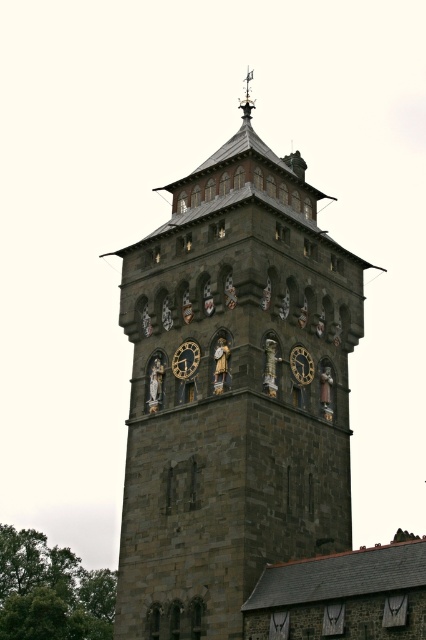
Between dark brown stone clock at center and gold/brass weather vane at top, which one is positioned higher?

gold/brass weather vane at top

Does dark brown stone clock at center have a lesser height compared to gold/brass weather vane at top?

Yes, dark brown stone clock at center is shorter than gold/brass weather vane at top.

Does point (195, 364) come closer to viewer compared to point (250, 100)?

Yes, it is.

You are a GUI agent. You are given a task and a screenshot of the screen. Output one action in this format:
    pyautogui.click(x=<x>, y=<y>)
    Task: Click on the dark brown stone clock at center
    The image size is (426, 640).
    Given the screenshot: What is the action you would take?
    pyautogui.click(x=186, y=358)

Can you confirm if dark brown stone clock at center is positioned above gold metallic clock at center?

Indeed, dark brown stone clock at center is positioned over gold metallic clock at center.

Which is above, dark brown stone clock at center or gold metallic clock at center?

dark brown stone clock at center is above.

This screenshot has width=426, height=640. Identify the location of dark brown stone clock at center. 186,358.

Is point (199, 636) farther from viewer compared to point (308, 365)?

No, it is in front of (308, 365).

Does dark stone clock tower at center have a greater width compared to gold metallic clock at center?

Yes, dark stone clock tower at center is wider than gold metallic clock at center.

Between point (284, 552) and point (302, 381), which one is positioned in front?

Point (284, 552) is in front.

I want to click on dark stone clock tower at center, so click(x=233, y=392).